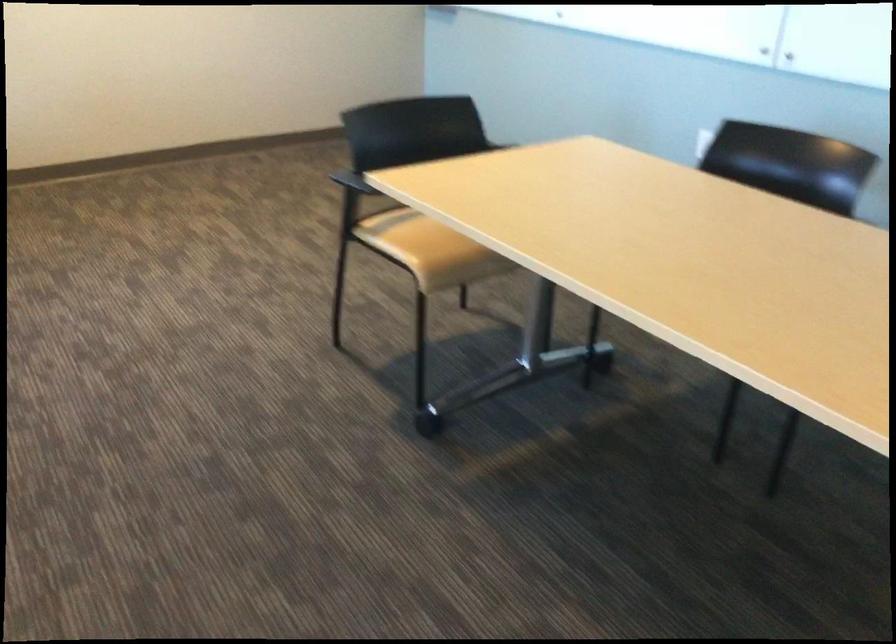
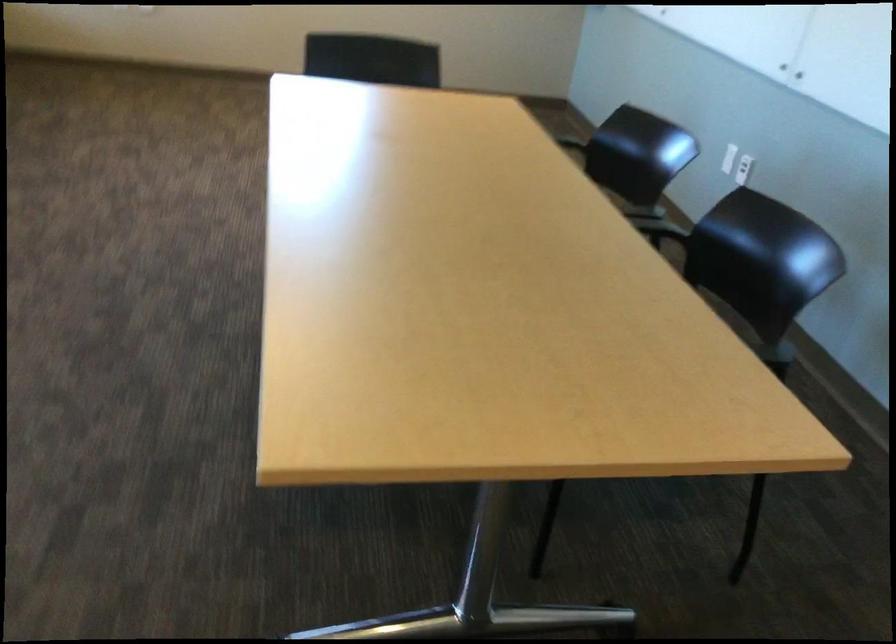
Question: In a continuous first-person perspective shot, in which direction is the camera moving?

Choices:
 (A) Left
 (B) Right
 (C) Forward
 (D) Backward

Answer: (B)